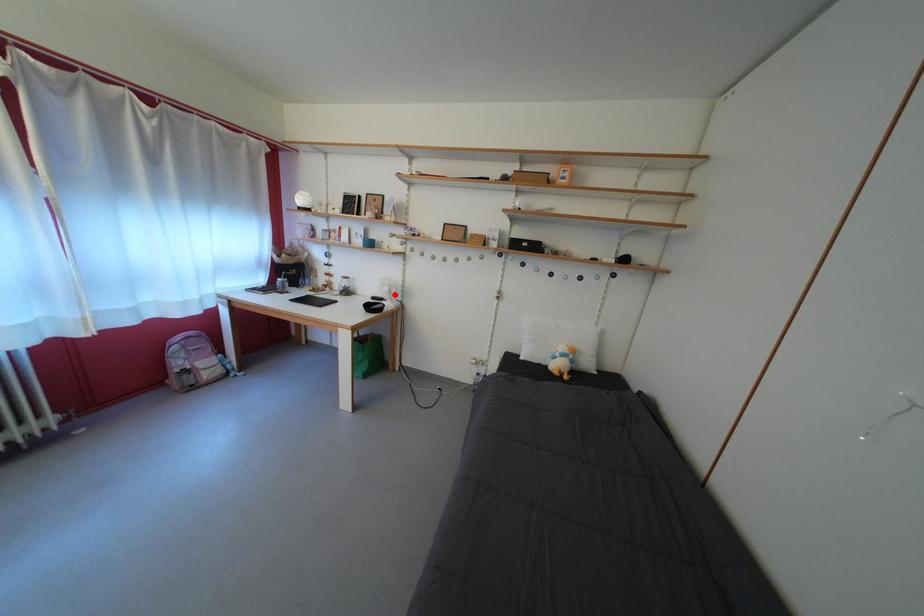
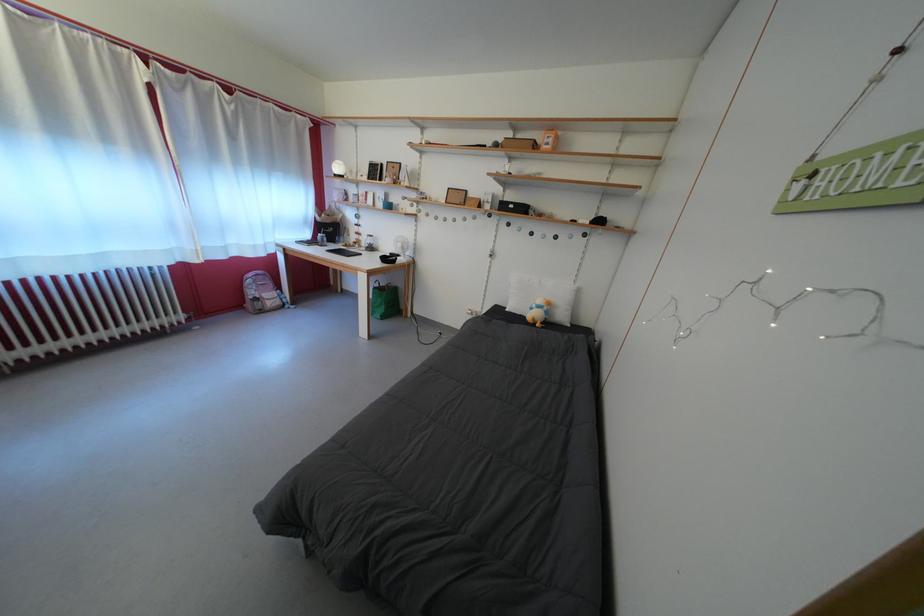
Question: I am providing you with two images of the same scene from different viewpoints. Given a red point in image1, look at the same physical point in image2. Is it:

Choices:
 (A) Closer to the viewpoint
 (B) Farther from the viewpoint

Answer: (A)